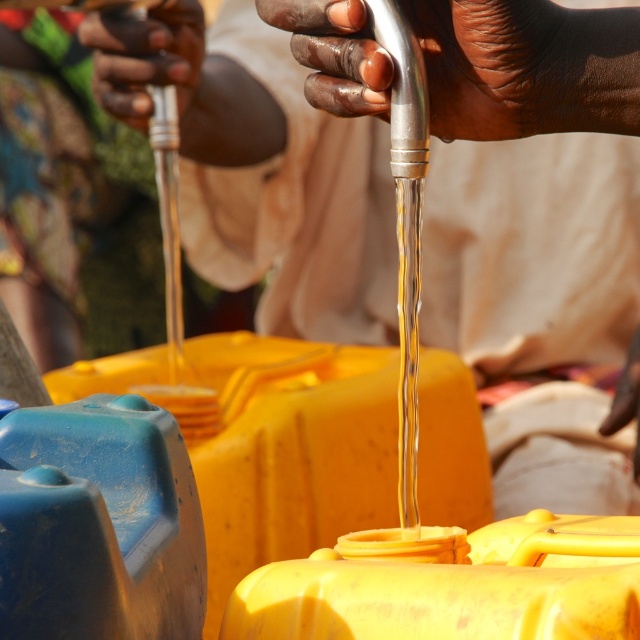
Where is `metallic silver faucet at upper center`? The image size is (640, 640). metallic silver faucet at upper center is located at coordinates (496, 67).

Who is lower down, metallic silver faucet at upper center or dark brown skin at upper left?

Positioned lower is metallic silver faucet at upper center.

Where is `metallic silver faucet at upper center`? The width and height of the screenshot is (640, 640). metallic silver faucet at upper center is located at coordinates (496, 67).

At what (x,y) coordinates should I click in order to perform the action: click on metallic silver faucet at upper center. Please return your answer as a coordinate pair (x, y). This screenshot has height=640, width=640. Looking at the image, I should click on (496, 67).